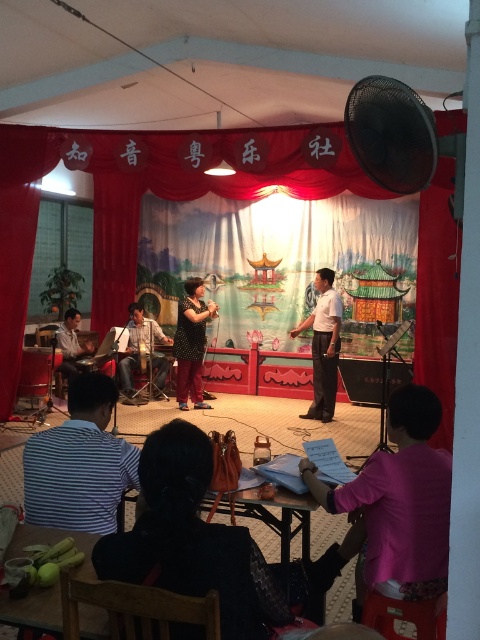
Question: Which point is closer to the camera?

Choices:
 (A) striped fabric shirt at lower left
 (B) white smooth shirt at center
 (C) red fabric curtain at upper center
 (D) matte black guitar at left

Answer: (A)

Question: Which of the following is the farthest from the observer?

Choices:
 (A) (323, 314)
 (B) (126, 401)
 (C) (46, 516)

Answer: (B)

Question: Is the position of striped fabric shirt at lower left less distant than that of white smooth shirt at center?

Choices:
 (A) yes
 (B) no

Answer: (A)

Question: Can you confirm if pink fabric at lower right is wider than matte black guitar at left?

Choices:
 (A) no
 (B) yes

Answer: (B)

Question: Can you confirm if patterned fabric dress at center is thinner than light brown wooden drum at center?

Choices:
 (A) yes
 (B) no

Answer: (A)

Question: Which object appears closest to the camera in this image?

Choices:
 (A) pink fabric at lower right
 (B) red fabric curtain at upper center

Answer: (A)